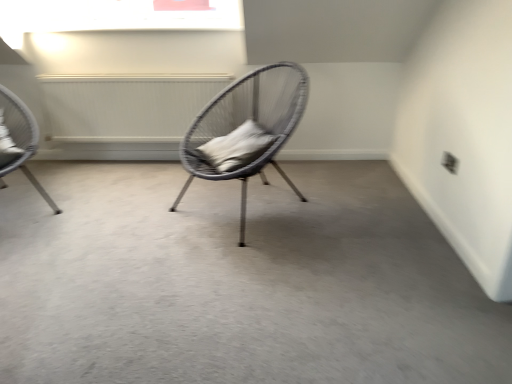
This screenshot has width=512, height=384. What do you see at coordinates (237, 282) in the screenshot?
I see `smooth gray carpet at center` at bounding box center [237, 282].

Where is `smooth gray carpet at center`? This screenshot has width=512, height=384. smooth gray carpet at center is located at coordinates (237, 282).

Can you confirm if woven grey chair at center, which appears as the 1th chair when viewed from the right, is thinner than gray fabric pillow at center?

In fact, woven grey chair at center, which appears as the 1th chair when viewed from the right, might be wider than gray fabric pillow at center.

Is woven grey chair at center, which appears as the 1th chair when viewed from the right, facing away from gray fabric pillow at center?

Yes, woven grey chair at center, which appears as the 1th chair when viewed from the right,'s orientation is away from gray fabric pillow at center.

Is woven grey chair at center, positioned as the second chair in left-to-right order, bigger or smaller than gray fabric pillow at center?

Considering their sizes, woven grey chair at center, positioned as the second chair in left-to-right order, takes up more space than gray fabric pillow at center.

Which is more to the right, woven grey chair at center, which appears as the 1th chair when viewed from the right, or gray fabric pillow at center?

Positioned to the right is woven grey chair at center, which appears as the 1th chair when viewed from the right.

From a real-world perspective, is gray fabric pillow at center physically located above or below matte wicker chair at left, which is counted as the 1th chair, starting from the left?

From a real-world perspective, gray fabric pillow at center is physically above matte wicker chair at left, which is counted as the 1th chair, starting from the left.

Identify the location of pillow to the right of matte wicker chair at left, the 2th chair when ordered from right to left. The image size is (512, 384). (236, 147).

From the image's perspective, is gray fabric pillow at center below matte wicker chair at left, which is counted as the 1th chair, starting from the left?

Indeed, from the image's perspective, gray fabric pillow at center is shown beneath matte wicker chair at left, which is counted as the 1th chair, starting from the left.

Considering the sizes of gray fabric pillow at center and matte wicker chair at left, which is counted as the 1th chair, starting from the left, in the image, is gray fabric pillow at center wider or thinner than matte wicker chair at left, which is counted as the 1th chair, starting from the left,?

In the image, gray fabric pillow at center appears to be more narrow than matte wicker chair at left, which is counted as the 1th chair, starting from the left.

From a real-world perspective, who is located higher, gray fabric pillow at center or smooth gray carpet at center?

In real-world perspective, gray fabric pillow at center is above.

Which object is positioned more to the left, gray fabric pillow at center or smooth gray carpet at center?

smooth gray carpet at center.

Is gray fabric pillow at center far from smooth gray carpet at center?

gray fabric pillow at center is near smooth gray carpet at center, not far away.

You are a GUI agent. You are given a task and a screenshot of the screen. Output one action in this format:
    pyautogui.click(x=<x>, y=<y>)
    Task: Click on the pillow above the white textured radiator at upper left (from a real-world perspective)
    Image resolution: width=512 pixels, height=384 pixels.
    Given the screenshot: What is the action you would take?
    pyautogui.click(x=236, y=147)

Is white textured radiator at upper left placed right next to gray fabric pillow at center?

No, white textured radiator at upper left is not beside gray fabric pillow at center.

Is white textured radiator at upper left turned away from gray fabric pillow at center?

white textured radiator at upper left is not turned away from gray fabric pillow at center.

Which object is positioned more to the right, white textured radiator at upper left or gray fabric pillow at center?

Positioned to the right is gray fabric pillow at center.

Can you tell me how much gray fabric pillow at center and white textured radiator at upper left differ in facing direction?

There is a 60.8-degree angle between the facing directions of gray fabric pillow at center and white textured radiator at upper left.

Relative to white textured radiator at upper left, is gray fabric pillow at center in front or behind?

In the image, gray fabric pillow at center appears in front of white textured radiator at upper left.

Does point (232, 134) appear closer or farther from the camera than point (188, 111)?

Point (232, 134) is positioned closer to the camera compared to point (188, 111).

Considering the positions of objects gray fabric pillow at center and white textured radiator at upper left in the image provided, who is more to the left, gray fabric pillow at center or white textured radiator at upper left?

From the viewer's perspective, white textured radiator at upper left appears more on the left side.

From the image's perspective, which one is positioned lower, matte wicker chair at left, the 2th chair when ordered from right to left, or gray fabric pillow at center?

gray fabric pillow at center.

Which of these two, matte wicker chair at left, the 2th chair when ordered from right to left, or gray fabric pillow at center, is bigger?

matte wicker chair at left, the 2th chair when ordered from right to left.

From a real-world perspective, is matte wicker chair at left, which is counted as the 1th chair, starting from the left, below gray fabric pillow at center?

Yes, from a real-world perspective, matte wicker chair at left, which is counted as the 1th chair, starting from the left, is below gray fabric pillow at center.

Considering the positions of point (36, 146) and point (259, 135), is point (36, 146) closer or farther from the camera than point (259, 135)?

Point (36, 146) is positioned farther from the camera compared to point (259, 135).

From the image's perspective, does smooth gray carpet at center appear lower than matte wicker chair at left, which is counted as the 1th chair, starting from the left?

Yes.

Is smooth gray carpet at center in front of matte wicker chair at left, which is counted as the 1th chair, starting from the left?

Yes, the depth of smooth gray carpet at center is less than that of matte wicker chair at left, which is counted as the 1th chair, starting from the left.

Is smooth gray carpet at center completely or partially outside of matte wicker chair at left, the 2th chair when ordered from right to left?

smooth gray carpet at center lies outside matte wicker chair at left, the 2th chair when ordered from right to left,'s area.

I want to click on pillow above the woven grey chair at center, positioned as the second chair in left-to-right order (from a real-world perspective), so click(236, 147).

From a real-world perspective, count 1st chairs downward from the gray fabric pillow at center and point to it. Please provide its 2D coordinates.

[(18, 141)]

Considering their positions, is gray fabric pillow at center positioned further to white textured radiator at upper left than woven grey chair at center, which appears as the 1th chair when viewed from the right?

Among the two, gray fabric pillow at center is located further to white textured radiator at upper left.

Looking at this image, which object lies further to the anchor point white textured radiator at upper left, matte wicker chair at left, the 2th chair when ordered from right to left, or gray fabric pillow at center?

The object further to white textured radiator at upper left is gray fabric pillow at center.

Which object lies further to the anchor point woven grey chair at center, positioned as the second chair in left-to-right order, smooth gray carpet at center or gray fabric pillow at center?

smooth gray carpet at center.

Which object lies nearer to the anchor point matte wicker chair at left, which is counted as the 1th chair, starting from the left, white textured radiator at upper left or smooth gray carpet at center?

white textured radiator at upper left is positioned closer to the anchor matte wicker chair at left, which is counted as the 1th chair, starting from the left.

Looking at the image, which one is located closer to gray fabric pillow at center, white textured radiator at upper left or smooth gray carpet at center?

Based on the image, smooth gray carpet at center appears to be nearer to gray fabric pillow at center.

Looking at the image, which one is located further to smooth gray carpet at center, white textured radiator at upper left or woven grey chair at center, positioned as the second chair in left-to-right order?

Among the two, white textured radiator at upper left is located further to smooth gray carpet at center.

From the image, which object appears to be nearer to matte wicker chair at left, which is counted as the 1th chair, starting from the left, gray fabric pillow at center or white textured radiator at upper left?

white textured radiator at upper left lies closer to matte wicker chair at left, which is counted as the 1th chair, starting from the left, than the other object.

Looking at the image, which one is located further to white textured radiator at upper left, smooth gray carpet at center or woven grey chair at center, which appears as the 1th chair when viewed from the right?

smooth gray carpet at center lies further to white textured radiator at upper left than the other object.

The height and width of the screenshot is (384, 512). Identify the location of concrete between matte wicker chair at left, the 2th chair when ordered from right to left, and woven grey chair at center, positioned as the second chair in left-to-right order, from left to right. (237, 282).

This screenshot has width=512, height=384. I want to click on radiator between matte wicker chair at left, the 2th chair when ordered from right to left, and gray fabric pillow at center, so click(x=126, y=105).

Where is `pillow located between woven grey chair at center, positioned as the second chair in left-to-right order, and white textured radiator at upper left in the depth direction`? pillow located between woven grey chair at center, positioned as the second chair in left-to-right order, and white textured radiator at upper left in the depth direction is located at coordinates (236, 147).

The image size is (512, 384). In order to click on pillow between matte wicker chair at left, which is counted as the 1th chair, starting from the left, and woven grey chair at center, which appears as the 1th chair when viewed from the right, in the horizontal direction in this screenshot , I will do `click(236, 147)`.